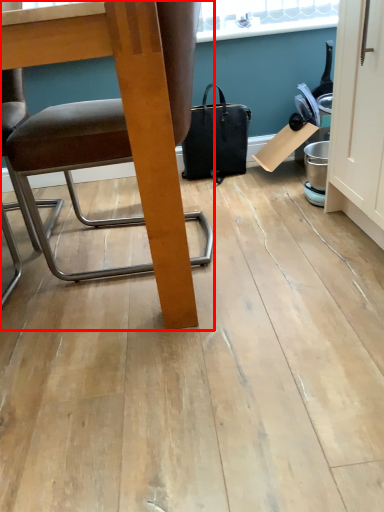
Question: In this image, where is chair (annotated by the red box) located relative to handbag?

Choices:
 (A) right
 (B) left

Answer: (B)